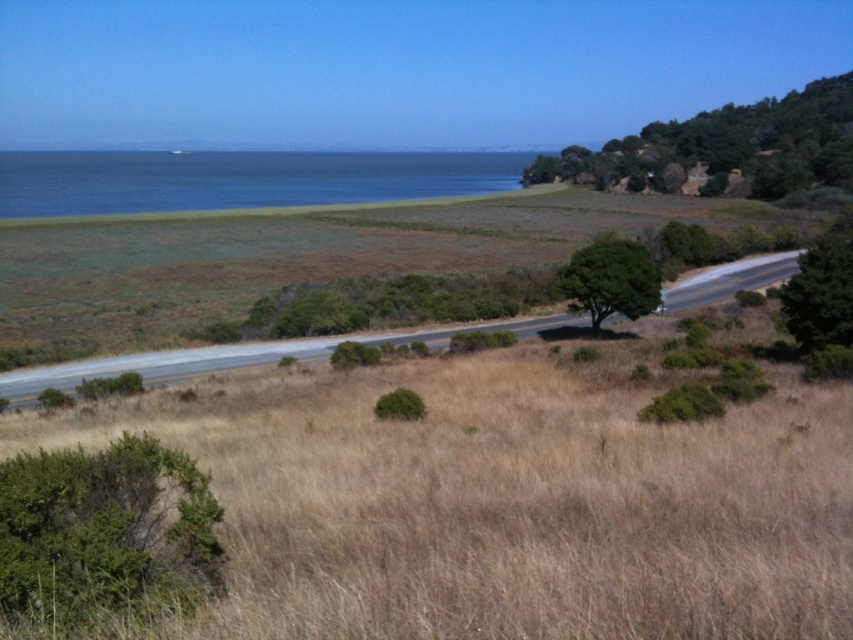
In the scene shown: Who is higher up, green leafy tree at upper right or green leafy tree at center?

Positioned higher is green leafy tree at upper right.

Is green leafy tree at upper right in front of green leafy tree at center?

No, it is behind green leafy tree at center.

Locate an element on the screen. The height and width of the screenshot is (640, 853). green leafy tree at upper right is located at coordinates (724, 148).

The width and height of the screenshot is (853, 640). In order to click on green leafy tree at upper right in this screenshot , I will do `click(724, 148)`.

Who is lower down, asphalt road at center or green leafy tree at center?

asphalt road at center is lower down.

Is asphalt road at center bigger than green leafy tree at center?

Indeed, asphalt road at center has a larger size compared to green leafy tree at center.

Is point (752, 266) farther from camera compared to point (643, 282)?

Yes, it is.

Locate an element on the screen. asphalt road at center is located at coordinates (238, 356).

Is green leafy tree at upper right thinner than green leafy tree at right?

No, green leafy tree at upper right is not thinner than green leafy tree at right.

Which is above, green leafy tree at upper right or green leafy tree at right?

green leafy tree at upper right is above.

Is point (634, 150) in front of point (840, 244)?

No, (634, 150) is further to viewer.

Locate an element on the screen. green leafy tree at upper right is located at coordinates click(724, 148).